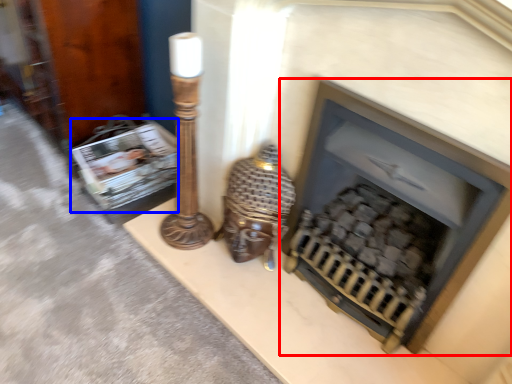
Question: Which object is closer to the camera taking this photo, fireplace (highlighted by a red box) or magazine (highlighted by a blue box)?

Choices:
 (A) fireplace
 (B) magazine

Answer: (A)